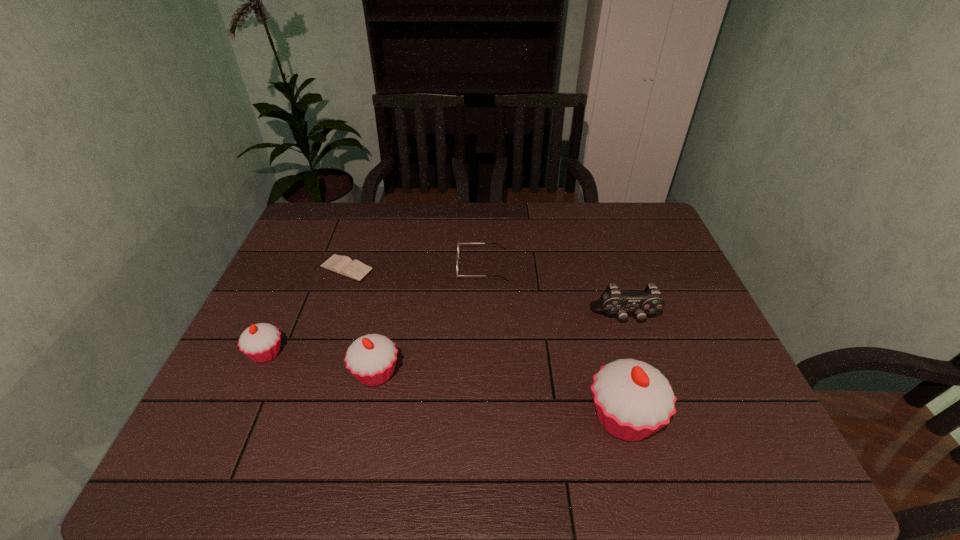
The height and width of the screenshot is (540, 960). In the image, there is a desktop. Identify the location of free region at the far edge. (426, 224).

Where is `free space at the near edge of the desktop`? This screenshot has height=540, width=960. free space at the near edge of the desktop is located at coordinates [x=557, y=420].

This screenshot has width=960, height=540. In the image, there is a desktop. In order to click on vacant space at the left edge in this screenshot , I will do `click(288, 253)`.

In order to click on free space at the right edge in this screenshot , I will do `click(651, 260)`.

In the image, there is a desktop. At what (x,y) coordinates should I click in order to perform the action: click on vacant space at the near right corner. Please return your answer as a coordinate pair (x, y). The image size is (960, 540). Looking at the image, I should click on (743, 418).

Image resolution: width=960 pixels, height=540 pixels. Find the location of `empty space that is in between the second shortest cupcake and the control`. empty space that is in between the second shortest cupcake and the control is located at coordinates (500, 346).

Where is `vacant area that lies between the tallest cupcake and the second tallest cupcake`? The image size is (960, 540). vacant area that lies between the tallest cupcake and the second tallest cupcake is located at coordinates (500, 395).

Locate an element on the screen. vacant area that lies between the fourth object from left to right and the tallest cupcake is located at coordinates (553, 342).

The image size is (960, 540). In order to click on vacant area between the third object from right to left and the control in this screenshot , I will do `click(554, 292)`.

Identify the location of free space between the third object from left to right and the second shortest object. (429, 320).